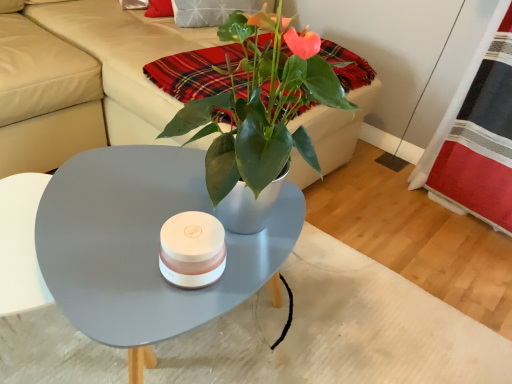
Question: Could you tell me if beige leather couch at upper center is facing red plaid fabric at right?

Choices:
 (A) no
 (B) yes

Answer: (B)

Question: From the image's perspective, would you say beige leather couch at upper center is shown under red plaid fabric at right?

Choices:
 (A) no
 (B) yes

Answer: (A)

Question: From a real-world perspective, is beige leather couch at upper center below red plaid fabric at right?

Choices:
 (A) yes
 (B) no

Answer: (A)

Question: Can you confirm if beige leather couch at upper center is taller than red plaid fabric at right?

Choices:
 (A) no
 (B) yes

Answer: (A)

Question: From a real-world perspective, does beige leather couch at upper center stand above red plaid fabric at right?

Choices:
 (A) no
 (B) yes

Answer: (A)

Question: Is beige leather couch at upper center behind red plaid fabric at right?

Choices:
 (A) no
 (B) yes

Answer: (A)

Question: Considering the relative positions of red plaid fabric at right and beige leather couch at upper center in the image provided, is red plaid fabric at right behind beige leather couch at upper center?

Choices:
 (A) yes
 (B) no

Answer: (A)

Question: Does red plaid fabric at right have a smaller size compared to beige leather couch at upper center?

Choices:
 (A) no
 (B) yes

Answer: (B)

Question: From the image's perspective, does red plaid fabric at right appear lower than beige leather couch at upper center?

Choices:
 (A) no
 (B) yes

Answer: (B)

Question: Considering the relative sizes of red plaid fabric at right and beige leather couch at upper center in the image provided, is red plaid fabric at right taller than beige leather couch at upper center?

Choices:
 (A) no
 (B) yes

Answer: (B)

Question: Is red plaid fabric at right positioned in front of beige leather couch at upper center?

Choices:
 (A) yes
 (B) no

Answer: (B)

Question: Does red plaid fabric at right have a lesser height compared to beige leather couch at upper center?

Choices:
 (A) no
 (B) yes

Answer: (A)

Question: Does red plaid fabric at right have a larger size compared to matte gray coffee table at center?

Choices:
 (A) no
 (B) yes

Answer: (A)